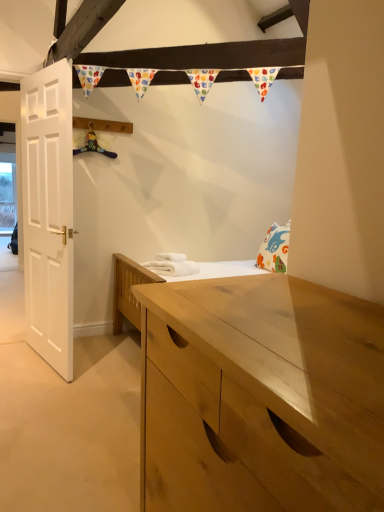
Question: Can you confirm if white soft towels at center is positioned to the right of white matte door at left?

Choices:
 (A) yes
 (B) no

Answer: (A)

Question: Considering the relative sizes of white soft towels at center and white matte door at left in the image provided, is white soft towels at center shorter than white matte door at left?

Choices:
 (A) no
 (B) yes

Answer: (B)

Question: Can you confirm if white soft towels at center is positioned to the left of white matte door at left?

Choices:
 (A) no
 (B) yes

Answer: (A)

Question: Is white soft towels at center positioned in front of white matte door at left?

Choices:
 (A) yes
 (B) no

Answer: (B)

Question: From the image's perspective, is white soft towels at center on white matte door at left?

Choices:
 (A) yes
 (B) no

Answer: (B)

Question: Are white soft towels at center and white matte door at left far apart?

Choices:
 (A) yes
 (B) no

Answer: (B)

Question: Is white soft towels at center located within white matte door at left?

Choices:
 (A) yes
 (B) no

Answer: (B)

Question: Does white matte door at left have a larger size compared to white soft towels at center?

Choices:
 (A) no
 (B) yes

Answer: (B)

Question: Would you say white matte door at left is a long distance from white soft towels at center?

Choices:
 (A) yes
 (B) no

Answer: (B)

Question: Is white matte door at left at the right side of white soft towels at center?

Choices:
 (A) no
 (B) yes

Answer: (A)

Question: Considering the relative sizes of white matte door at left and white soft towels at center in the image provided, is white matte door at left smaller than white soft towels at center?

Choices:
 (A) no
 (B) yes

Answer: (A)

Question: Is white matte door at left next to white soft towels at center and touching it?

Choices:
 (A) yes
 (B) no

Answer: (B)

Question: Is white soft towels at center bigger or smaller than white matte door at left?

Choices:
 (A) big
 (B) small

Answer: (B)